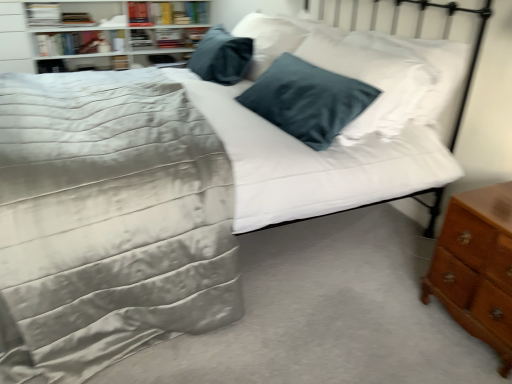
Measure the distance between hardcover book at upper left, the 3th book positioned from the left, and camera.

They are 4.06 meters apart.

What do you see at coordinates (168, 13) in the screenshot?
I see `hardcover book at upper left, the 1th book when ordered from right to left` at bounding box center [168, 13].

At what (x,y) coordinates should I click in order to perform the action: click on hardcover book at upper left, the 1th book when ordered from right to left. Please return your answer as a coordinate pair (x, y). This screenshot has width=512, height=384. Looking at the image, I should click on (168, 13).

In order to face white glossy bookshelf at upper left, should I rotate leftwards or rightwards?

It's best to rotate left around 19.195 degrees.

This screenshot has height=384, width=512. I want to click on white glossy bookshelf at upper left, so click(x=119, y=31).

Image resolution: width=512 pixels, height=384 pixels. What do you see at coordinates (79, 42) in the screenshot? I see `hardcover book at upper left, the second book when ordered from left to right` at bounding box center [79, 42].

I want to click on hardcover book at upper left, placed as the fourth book when sorted from right to left, so click(42, 14).

Who is smaller, hardcover book at upper left, the second book when ordered from left to right, or white glossy bookshelf at upper left?

With smaller size is hardcover book at upper left, the second book when ordered from left to right.

Consider the image. Is hardcover book at upper left, which is the third book from right to left, directly adjacent to white glossy bookshelf at upper left?

hardcover book at upper left, which is the third book from right to left, and white glossy bookshelf at upper left are not in contact.

From a real-world perspective, who is located higher, hardcover book at upper left, which is the third book from right to left, or white glossy bookshelf at upper left?

hardcover book at upper left, which is the third book from right to left.

From a real-world perspective, is hardcover book at upper left, the 1th book when ordered from right to left, beneath satin gray comforter at center?

No, from a real-world perspective, hardcover book at upper left, the 1th book when ordered from right to left, is not below satin gray comforter at center.

Is hardcover book at upper left, positioned as the 4th book in left-to-right order, wider or thinner than satin gray comforter at center?

Clearly, hardcover book at upper left, positioned as the 4th book in left-to-right order, has less width compared to satin gray comforter at center.

From the picture: Can you confirm if hardcover book at upper left, the 1th book when ordered from right to left, is positioned to the left of satin gray comforter at center?

Correct, you'll find hardcover book at upper left, the 1th book when ordered from right to left, to the left of satin gray comforter at center.

From the image's perspective, would you say hardcover book at upper left, positioned as the 4th book in left-to-right order, is shown under satin gray comforter at center?

No, from the image's perspective, hardcover book at upper left, positioned as the 4th book in left-to-right order, is not below satin gray comforter at center.

Would you say satin gray comforter at center is a long distance from hardcover book at upper left, the second book when ordered from left to right?

Yes, satin gray comforter at center and hardcover book at upper left, the second book when ordered from left to right, are quite far apart.

Looking at this image, is satin gray comforter at center facing away from hardcover book at upper left, which is the third book from right to left?

satin gray comforter at center does not have its back to hardcover book at upper left, which is the third book from right to left.

Is satin gray comforter at center at the left side of hardcover book at upper left, which is the third book from right to left?

Incorrect, satin gray comforter at center is not on the left side of hardcover book at upper left, which is the third book from right to left.

Which object is further away from the camera taking this photo, satin gray comforter at center or hardcover book at upper left, which is the third book from right to left?

hardcover book at upper left, which is the third book from right to left, is further away from the camera.

Could you tell me if brown wooden nightstand at lower right is facing hardcover book at upper left, which is the first book from left to right?

No, brown wooden nightstand at lower right is not facing towards hardcover book at upper left, which is the first book from left to right.

Could hardcover book at upper left, which is the first book from left to right, be considered to be inside brown wooden nightstand at lower right?

No, hardcover book at upper left, which is the first book from left to right, is not surrounded by brown wooden nightstand at lower right.

Looking at this image, which of these two, brown wooden nightstand at lower right or hardcover book at upper left, placed as the fourth book when sorted from right to left, stands shorter?

hardcover book at upper left, placed as the fourth book when sorted from right to left, is shorter.

How much distance is there between brown wooden nightstand at lower right and hardcover book at upper left, placed as the fourth book when sorted from right to left?

brown wooden nightstand at lower right is 4.10 meters away from hardcover book at upper left, placed as the fourth book when sorted from right to left.

Measure the distance from hardcover book at upper left, the second book when ordered from left to right, to hardcover book at upper left, which appears as the 2th book when viewed from the right.

hardcover book at upper left, the second book when ordered from left to right, and hardcover book at upper left, which appears as the 2th book when viewed from the right, are 8.04 inches apart from each other.

What's the angular difference between hardcover book at upper left, which is the third book from right to left, and hardcover book at upper left, which appears as the 2th book when viewed from the right,'s facing directions?

There is a 0.418-degree angle between the facing directions of hardcover book at upper left, which is the third book from right to left, and hardcover book at upper left, which appears as the 2th book when viewed from the right.

From the image's perspective, which one is positioned higher, hardcover book at upper left, the second book when ordered from left to right, or hardcover book at upper left, the 3th book positioned from the left?

From the image's view, hardcover book at upper left, the 3th book positioned from the left, is above.

Considering the points (75, 32) and (73, 25), which point is in front, point (75, 32) or point (73, 25)?

The point (73, 25) is closer.

Is white glossy bookshelf at upper left bigger or smaller than brown wooden nightstand at lower right?

Considering their sizes, white glossy bookshelf at upper left takes up more space than brown wooden nightstand at lower right.

From a real-world perspective, is white glossy bookshelf at upper left positioned under brown wooden nightstand at lower right based on gravity?

No, from a real-world perspective, white glossy bookshelf at upper left is not under brown wooden nightstand at lower right.

In order to click on bedding in front of the white glossy bookshelf at upper left in this screenshot , I will do `click(109, 220)`.

Which of these two, white glossy bookshelf at upper left or satin gray comforter at center, stands shorter?

Standing shorter between the two is white glossy bookshelf at upper left.

From the image's perspective, is white glossy bookshelf at upper left above satin gray comforter at center?

Yes, from the image's perspective, white glossy bookshelf at upper left is above satin gray comforter at center.

Can you confirm if white glossy bookshelf at upper left is thinner than satin gray comforter at center?

Correct, the width of white glossy bookshelf at upper left is less than that of satin gray comforter at center.

This screenshot has width=512, height=384. What are the coordinates of `the 2nd book to the left of the white glossy bookshelf at upper left, counting from the anchor's position` in the screenshot? It's located at [x=79, y=42].

Locate an element on the screen. the 4th book positioned above the satin gray comforter at center (from a real-world perspective) is located at coordinates (168, 13).

Looking at the image, which one is located further to hardcover book at upper left, which appears as the 2th book when viewed from the right, hardcover book at upper left, which is the third book from right to left, or white glossy bookshelf at upper left?

The object further to hardcover book at upper left, which appears as the 2th book when viewed from the right, is white glossy bookshelf at upper left.

Looking at the image, which one is located closer to hardcover book at upper left, placed as the fourth book when sorted from right to left, brown wooden nightstand at lower right or hardcover book at upper left, positioned as the 4th book in left-to-right order?

Based on the image, hardcover book at upper left, positioned as the 4th book in left-to-right order, appears to be nearer to hardcover book at upper left, placed as the fourth book when sorted from right to left.

Estimate the real-world distances between objects in this image. Which object is closer to hardcover book at upper left, positioned as the 4th book in left-to-right order, hardcover book at upper left, which is the third book from right to left, or satin gray comforter at center?

hardcover book at upper left, which is the third book from right to left, is positioned closer to the anchor hardcover book at upper left, positioned as the 4th book in left-to-right order.

When comparing their distances from hardcover book at upper left, which is the first book from left to right, does hardcover book at upper left, which appears as the 2th book when viewed from the right, or hardcover book at upper left, which is the third book from right to left, seem closer?

hardcover book at upper left, which appears as the 2th book when viewed from the right.

In the scene shown: Looking at the image, which one is located further to white glossy bookshelf at upper left, satin gray comforter at center or hardcover book at upper left, which is the first book from left to right?

satin gray comforter at center is further to white glossy bookshelf at upper left.

Based on the photo, when comparing their distances from hardcover book at upper left, which is the first book from left to right, does white glossy bookshelf at upper left or hardcover book at upper left, positioned as the 4th book in left-to-right order, seem further?

hardcover book at upper left, positioned as the 4th book in left-to-right order, lies further to hardcover book at upper left, which is the first book from left to right, than the other object.

Which object lies nearer to the anchor point satin gray comforter at center, hardcover book at upper left, positioned as the 4th book in left-to-right order, or white glossy bookshelf at upper left?

Among the two, white glossy bookshelf at upper left is located nearer to satin gray comforter at center.

Which object lies further to the anchor point white glossy bookshelf at upper left, satin gray comforter at center or hardcover book at upper left, the 3th book positioned from the left?

satin gray comforter at center lies further to white glossy bookshelf at upper left than the other object.

This screenshot has height=384, width=512. Identify the location of shelf located between hardcover book at upper left, which is the first book from left to right, and hardcover book at upper left, positioned as the 4th book in left-to-right order, in the left-right direction. (119, 31).

Identify the location of shelf between satin gray comforter at center and hardcover book at upper left, which appears as the 2th book when viewed from the right, from front to back. (119, 31).

The image size is (512, 384). I want to click on nightstand between satin gray comforter at center and hardcover book at upper left, positioned as the 4th book in left-to-right order, in the front-back direction, so click(477, 267).

Locate an element on the screen. Image resolution: width=512 pixels, height=384 pixels. nightstand between satin gray comforter at center and white glossy bookshelf at upper left from front to back is located at coordinates (477, 267).